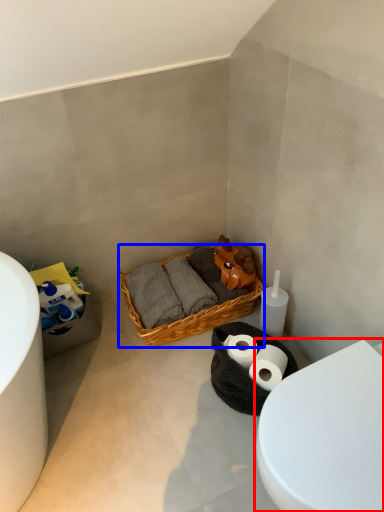
Question: Which of the following is the closest to the observer, toilet (highlighted by a red box) or picnic basket (highlighted by a blue box)?

Choices:
 (A) toilet
 (B) picnic basket

Answer: (A)